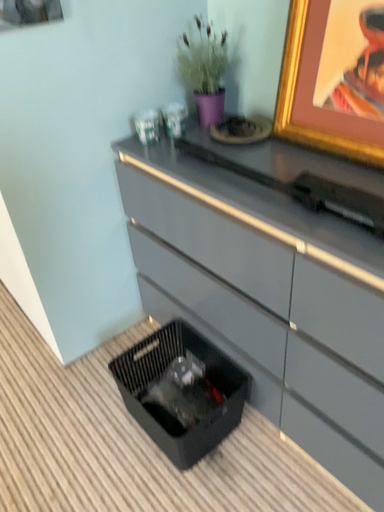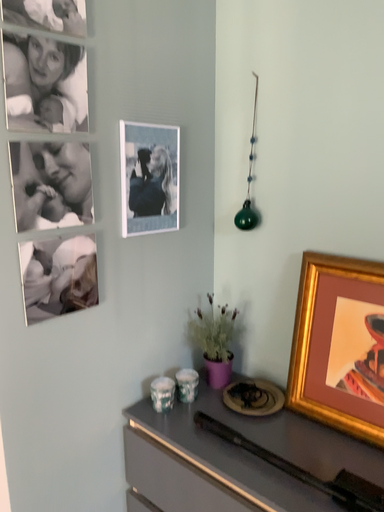
Question: How did the camera likely rotate when shooting the video?

Choices:
 (A) rotated right
 (B) rotated left

Answer: (A)